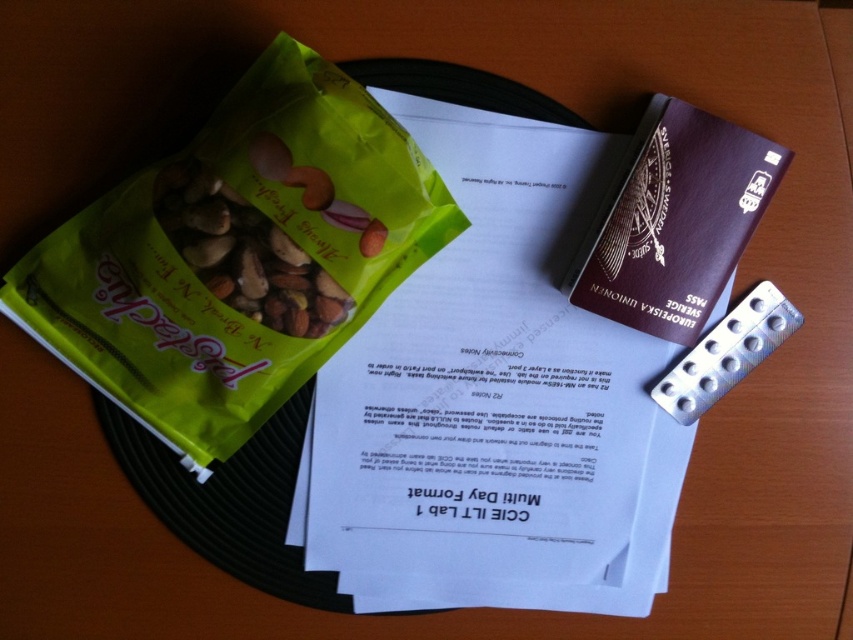
You are organizing items on a table and see the green matte snack packet at left and the green matte snack mix at center. Which one is located more to the left?

The green matte snack packet at left is positioned on the left side of the green matte snack mix at center, so it is more to the left.

You are organizing items on a table and need to place the green matte snack packet at left and the brown leather passport at upper right into a drawer. The drawer has a width of 20 cm. Can both items fit side by side horizontally?

The green matte snack packet at left is larger in size than the brown leather passport at upper right. Since the drawer is only 20 cm wide, it is uncertain if both can fit without overlapping unless the combined width of both items is less than or equal to 20 cm. However, the exact dimensions of each item are not provided, so we cannot confirm definitively.

You are looking at a table with two points marked on it. The first point is at coordinates point (x=721, y=248) and the second is at point (x=236, y=257). Which point is closer to you?

Point (x=721, y=248) is closer to you because it is further to the viewer than point (x=236, y=257).